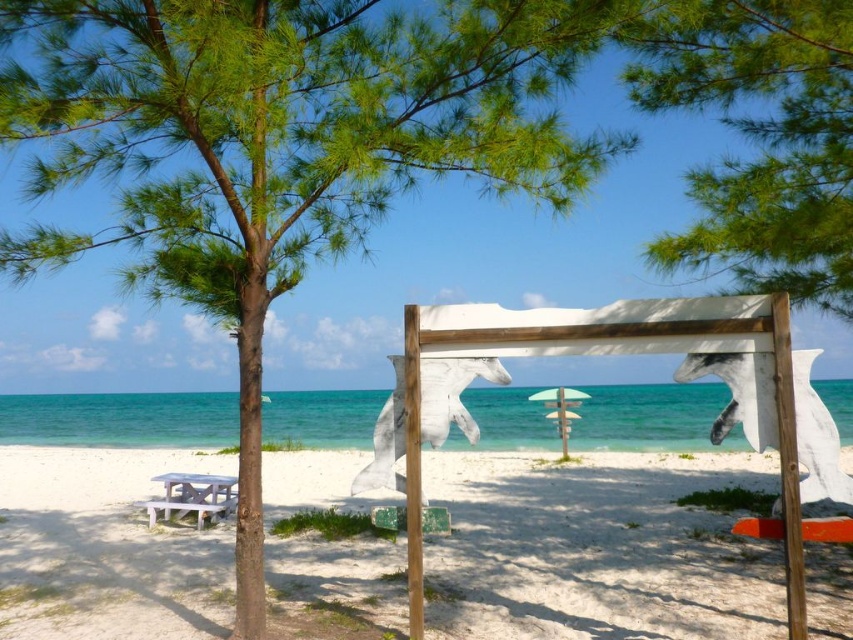
Consider the image. You are standing at the center of the beach scene and want to find the point located at coordinates (596, 548). According to the scene description, where exactly is this point located?

The point at coordinates (596, 548) is on the white wooden sign at center.

Consider the image. You are standing at the center of the beach and want to place a new bench exactly at the same 2D location as the white wooden sign at center. What are the coordinates where you should place the bench?

The coordinates for the white wooden sign at center are at point (596, 548), so you should place the bench at the same coordinates (596, 548).

You are planning to set up a shaded area for a beach picnic. You have two umbrellas available, the white plastic umbrella at center and the green fabric umbrella at center. Which one would provide more shade coverage?

The white plastic umbrella at center has a larger size compared to the green fabric umbrella at center, so it would provide more shade coverage.